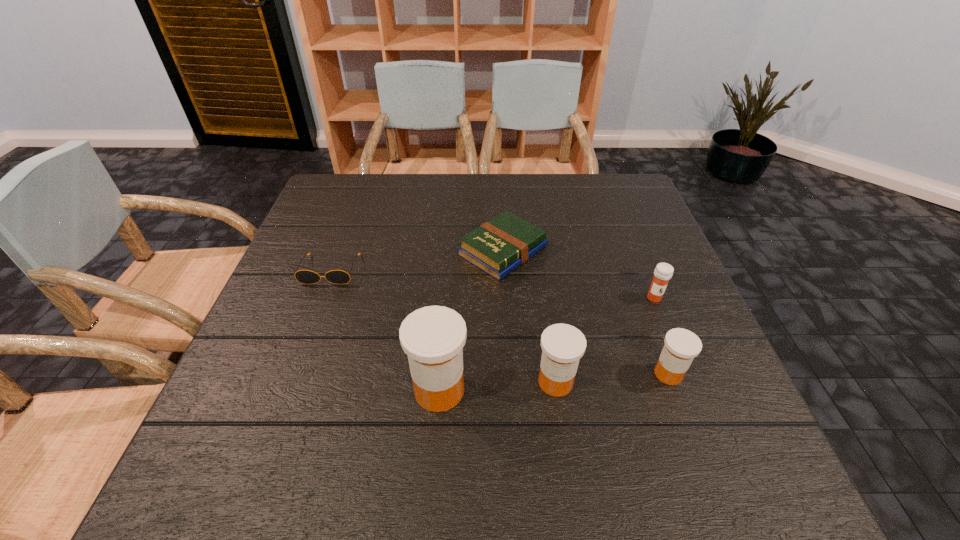
This screenshot has height=540, width=960. Identify the location of the tallest object. (433, 337).

At what (x,y) coordinates should I click in order to perform the action: click on the tallest medicine. Please return your answer as a coordinate pair (x, y). Looking at the image, I should click on click(x=433, y=337).

The width and height of the screenshot is (960, 540). Find the location of `the second tallest medicine`. the second tallest medicine is located at coordinates (563, 345).

Where is `the second tallest object`? The width and height of the screenshot is (960, 540). the second tallest object is located at coordinates (563, 345).

Locate an element on the screen. book is located at coordinates (499, 246).

Locate an element on the screen. the leftmost object is located at coordinates (x=303, y=276).

At what (x,y) coordinates should I click in order to perform the action: click on the third farthest object. Please return your answer as a coordinate pair (x, y). Looking at the image, I should click on (663, 272).

This screenshot has height=540, width=960. I want to click on vacant space located on the label of the tallest object, so click(x=589, y=390).

Where is `free spot located 0.140m on the left of the book`? The height and width of the screenshot is (540, 960). free spot located 0.140m on the left of the book is located at coordinates (404, 251).

Image resolution: width=960 pixels, height=540 pixels. I want to click on vacant area situated on the front-facing side of the sunglasses, so click(294, 370).